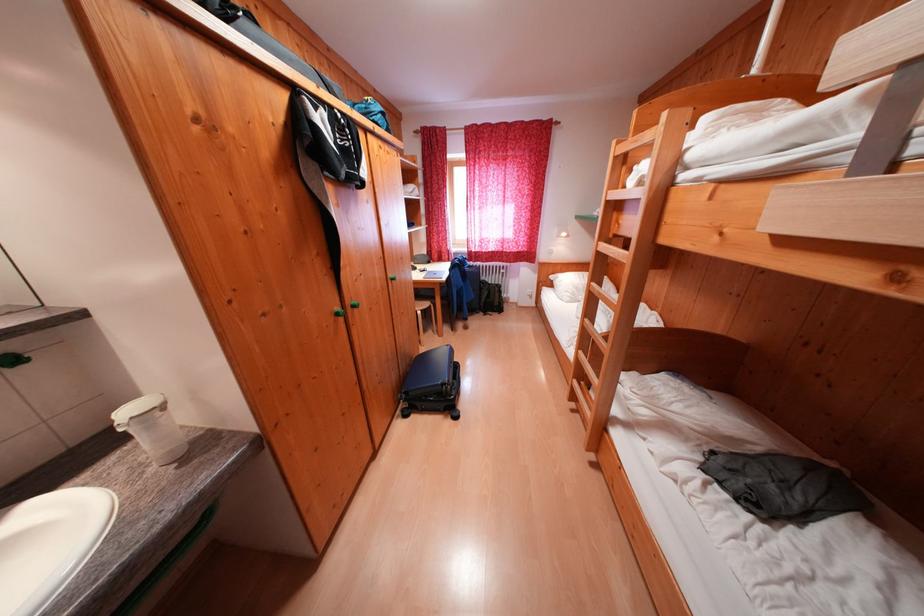
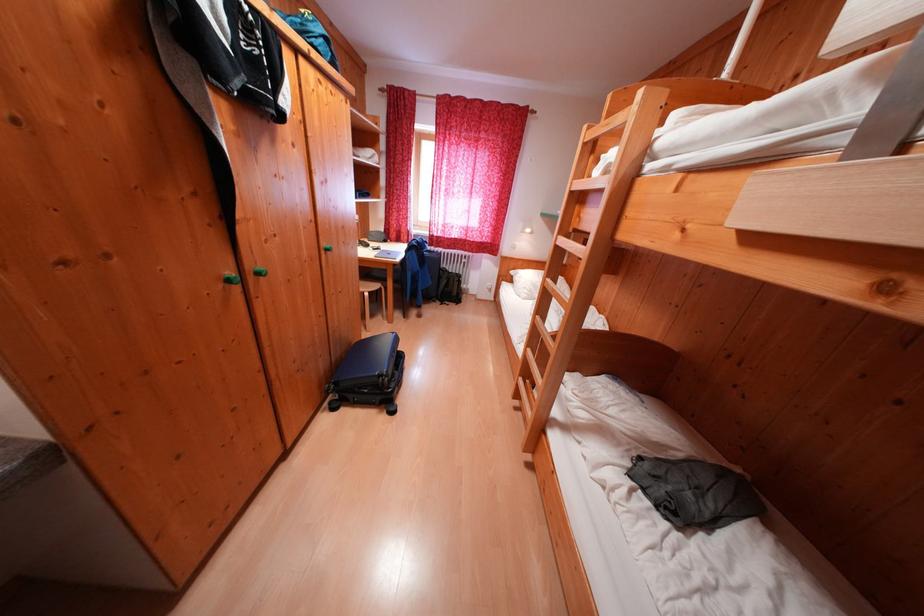
Question: The camera is either moving clockwise (left) or counter-clockwise (right) around the object. The first image is from the beginning of the video and the second image is from the end. Is the camera moving left or right when shooting the video?

Choices:
 (A) Left
 (B) Right

Answer: (A)